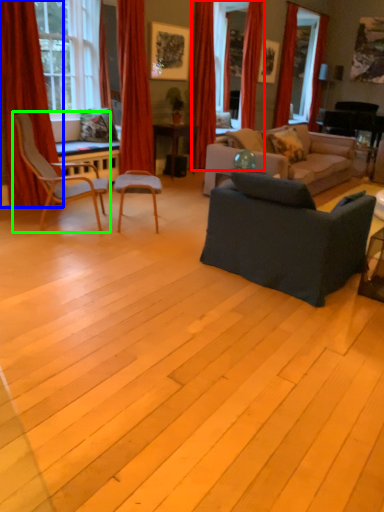
Question: Based on their relative distances, which object is farther from curtain (highlighted by a red box)? Choose from curtain (highlighted by a blue box) and chair (highlighted by a green box).

Choices:
 (A) curtain
 (B) chair

Answer: (A)